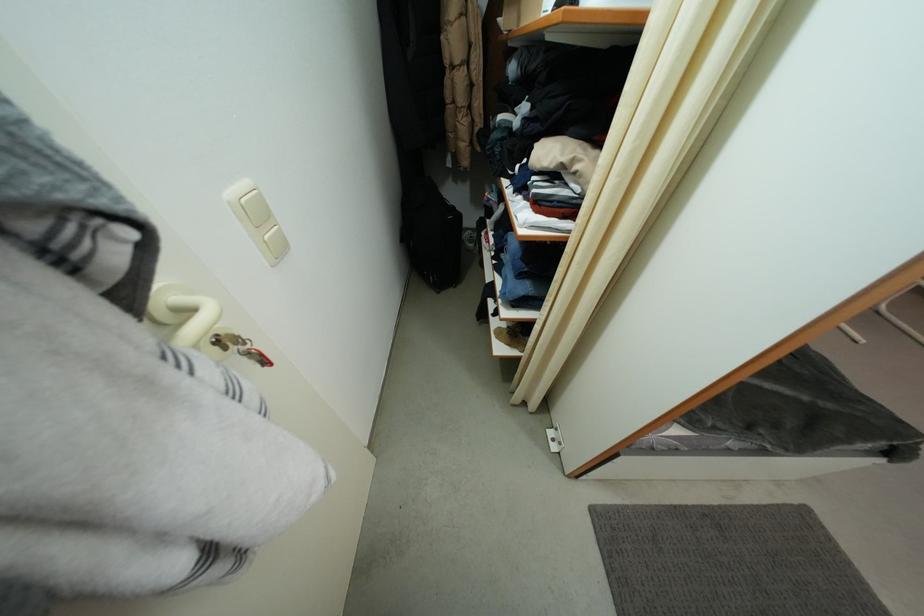
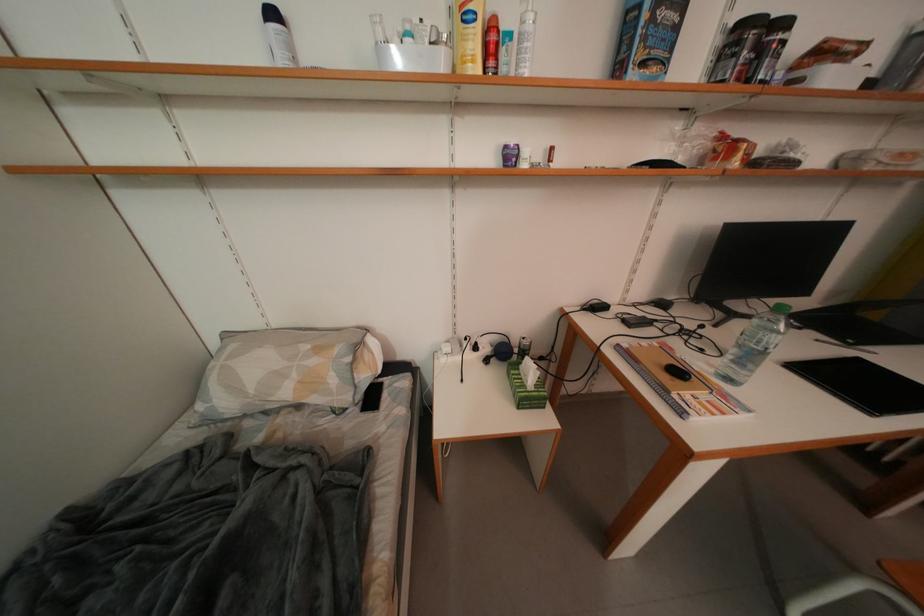
The images are taken continuously from a first-person perspective. In which direction are you moving?

The cameraman walked toward right, forward.